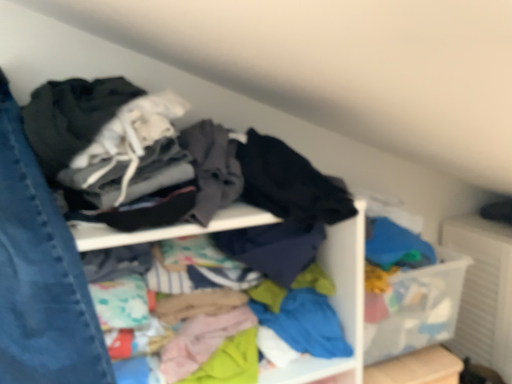
Question: Should I look upward or downward to see denim at left?

Choices:
 (A) up
 (B) down

Answer: (B)

Question: From the image's perspective, is multicolored fabric at center located above denim at left?

Choices:
 (A) yes
 (B) no

Answer: (B)

Question: Is multicolored fabric at center facing towards denim at left?

Choices:
 (A) yes
 (B) no

Answer: (A)

Question: Does multicolored fabric at center contain denim at left?

Choices:
 (A) no
 (B) yes

Answer: (A)

Question: Are multicolored fabric at center and denim at left far apart?

Choices:
 (A) no
 (B) yes

Answer: (A)

Question: From the image's perspective, would you say multicolored fabric at center is shown under denim at left?

Choices:
 (A) yes
 (B) no

Answer: (A)

Question: Considering the relative positions of multicolored fabric at center and denim at left in the image provided, is multicolored fabric at center to the right of denim at left from the viewer's perspective?

Choices:
 (A) yes
 (B) no

Answer: (A)

Question: From the image's perspective, is denim at left under multicolored fabric at center?

Choices:
 (A) no
 (B) yes

Answer: (A)

Question: From a real-world perspective, is denim at left over multicolored fabric at center?

Choices:
 (A) no
 (B) yes

Answer: (B)

Question: Would you consider denim at left to be distant from multicolored fabric at center?

Choices:
 (A) no
 (B) yes

Answer: (A)

Question: Is denim at left wider than multicolored fabric at center?

Choices:
 (A) no
 (B) yes

Answer: (B)

Question: Is denim at left turned away from multicolored fabric at center?

Choices:
 (A) no
 (B) yes

Answer: (B)

Question: Is denim at left positioned before multicolored fabric at center?

Choices:
 (A) yes
 (B) no

Answer: (A)

Question: Considering their positions, is denim at left located in front of or behind multicolored fabric at center?

Choices:
 (A) front
 (B) behind

Answer: (A)